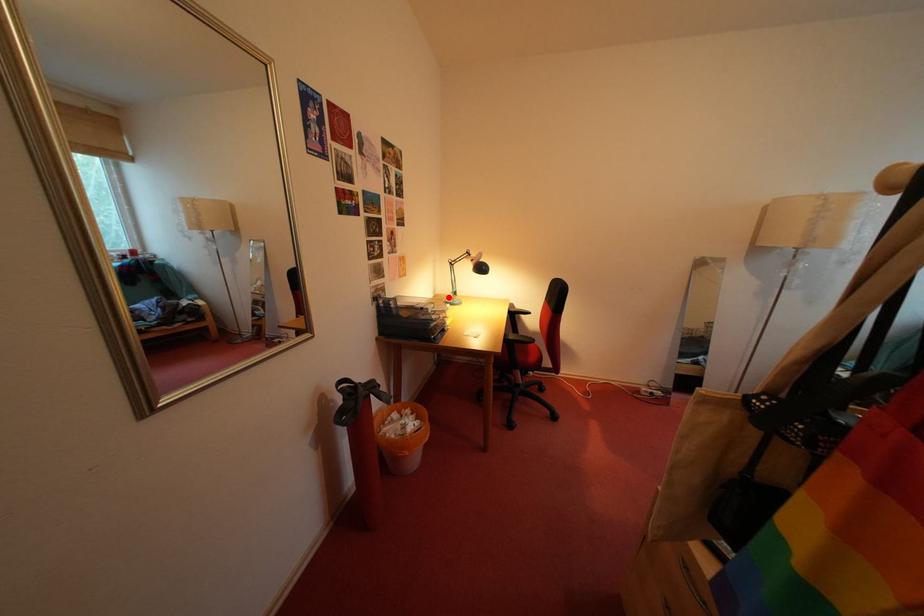
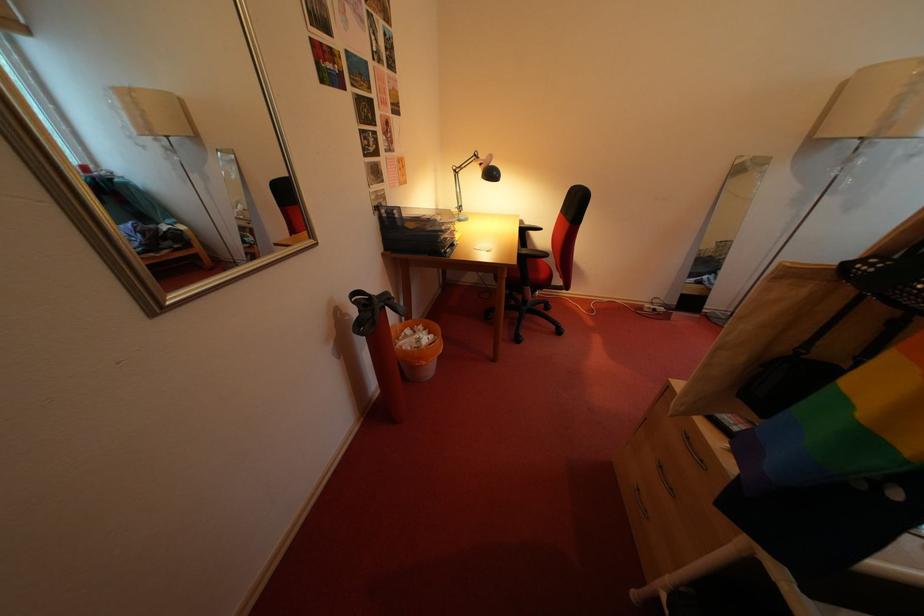
Locate, in the second image, the point that corresponds to the highlighted location in the first image.

(451, 214)